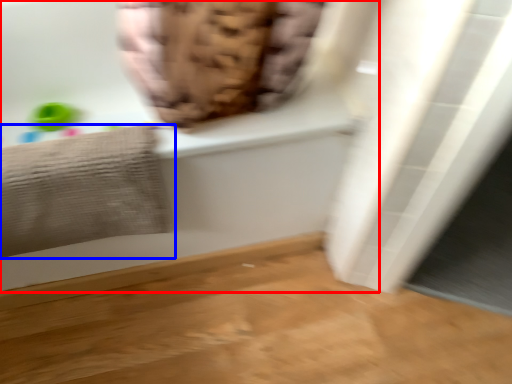
Question: Which point is further to the camera, bathtub (highlighted by a red box) or towel (highlighted by a blue box)?

Choices:
 (A) bathtub
 (B) towel

Answer: (B)